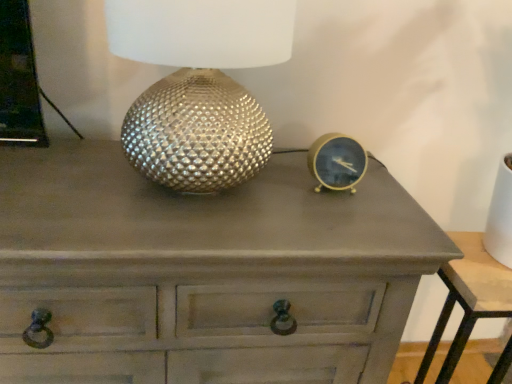
Where is `vacant area that lies between metallic textured lamp at center and gold metallic clock at right`? vacant area that lies between metallic textured lamp at center and gold metallic clock at right is located at coordinates (297, 191).